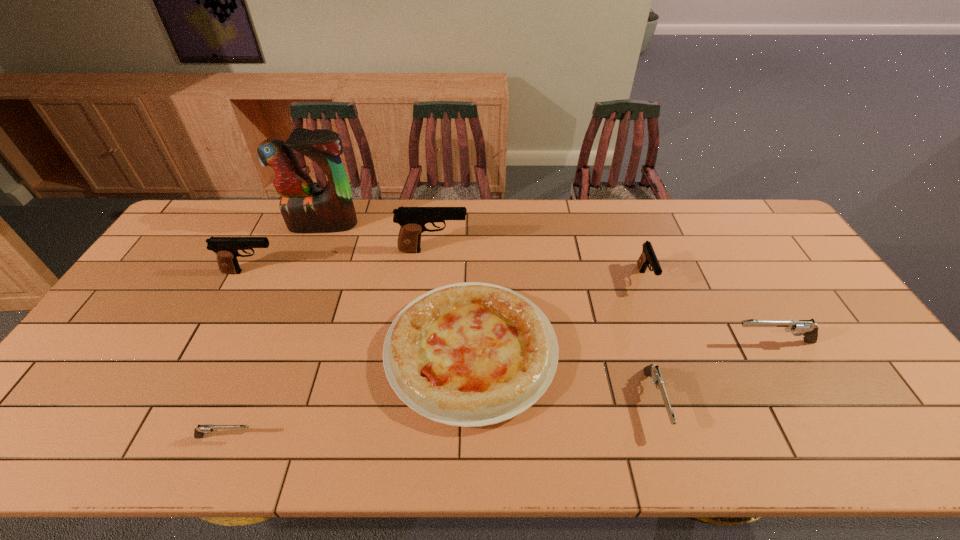
This screenshot has width=960, height=540. In order to click on parrot in this screenshot , I will do `click(304, 209)`.

This screenshot has height=540, width=960. In order to click on the farthest object in this screenshot , I will do `click(304, 209)`.

Image resolution: width=960 pixels, height=540 pixels. What are the coordinates of `the second black pistol from right to left` in the screenshot? It's located at (412, 220).

Image resolution: width=960 pixels, height=540 pixels. I want to click on the biggest black pistol, so click(412, 220).

This screenshot has height=540, width=960. I want to click on the second biggest black pistol, so click(226, 248).

Where is `the sixth shortest object`? the sixth shortest object is located at coordinates (226, 248).

Identify the location of the rightmost black pistol. This screenshot has height=540, width=960. 648,256.

At what (x,y) coordinates should I click in order to perform the action: click on the smallest black pistol. Please return your answer as a coordinate pair (x, y). Looking at the image, I should click on (648, 256).

At what (x,y) coordinates should I click in order to perform the action: click on the third nearest pistol. Please return your answer as a coordinate pair (x, y). The width and height of the screenshot is (960, 540). Looking at the image, I should click on (809, 330).

Where is `the rightmost object`? The width and height of the screenshot is (960, 540). the rightmost object is located at coordinates (809, 330).